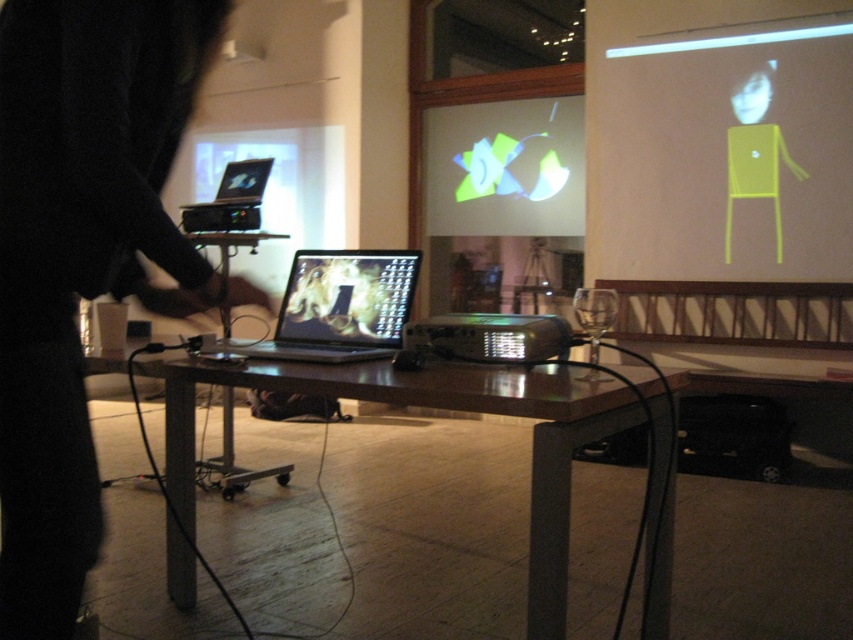
Consider the image. Is the position of black fabric at left more distant than that of wooden table at center?

No, it is in front of wooden table at center.

You are a GUI agent. You are given a task and a screenshot of the screen. Output one action in this format:
    pyautogui.click(x=<x>, y=<y>)
    Task: Click on the black fabric at left
    The height and width of the screenshot is (640, 853).
    Given the screenshot: What is the action you would take?
    pyautogui.click(x=83, y=257)

Can you confirm if neon plastic geometric shapes at center is positioned below shiny black laptop at center?

Actually, neon plastic geometric shapes at center is above shiny black laptop at center.

Looking at this image, is neon plastic geometric shapes at center taller than shiny black laptop at center?

Yes.

What do you see at coordinates (503, 168) in the screenshot?
I see `neon plastic geometric shapes at center` at bounding box center [503, 168].

At what (x,y) coordinates should I click in order to perform the action: click on neon plastic geometric shapes at center. Please return your answer as a coordinate pair (x, y). This screenshot has width=853, height=640. Looking at the image, I should click on (503, 168).

Is point (672, 468) in front of point (479, 321)?

Yes, it is in front of point (479, 321).

Can you confirm if wooden table at center is wider than black plastic projector at center?

Yes, wooden table at center is wider than black plastic projector at center.

Who is more forward, (524,394) or (558,349)?

Point (524,394)

The height and width of the screenshot is (640, 853). Find the location of `wooden table at center`. wooden table at center is located at coordinates (473, 410).